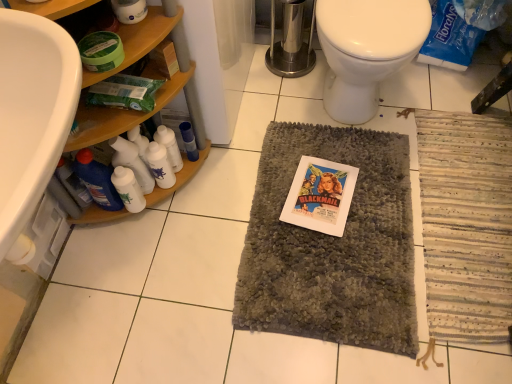
This screenshot has height=384, width=512. I want to click on vacant area situated to the left side of matte paper comic book at center, so click(x=269, y=205).